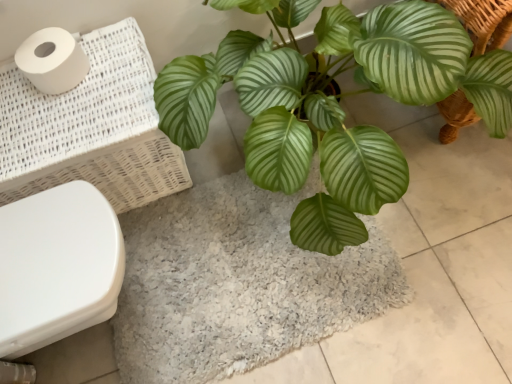
You are a GUI agent. You are given a task and a screenshot of the screen. Output one action in this format:
    pyautogui.click(x=<x>, y=<y>)
    Task: Click on the empty space that is ontop of white matte toilet paper at upper left (from a real-world perspective)
    
    Given the screenshot: What is the action you would take?
    pyautogui.click(x=50, y=44)